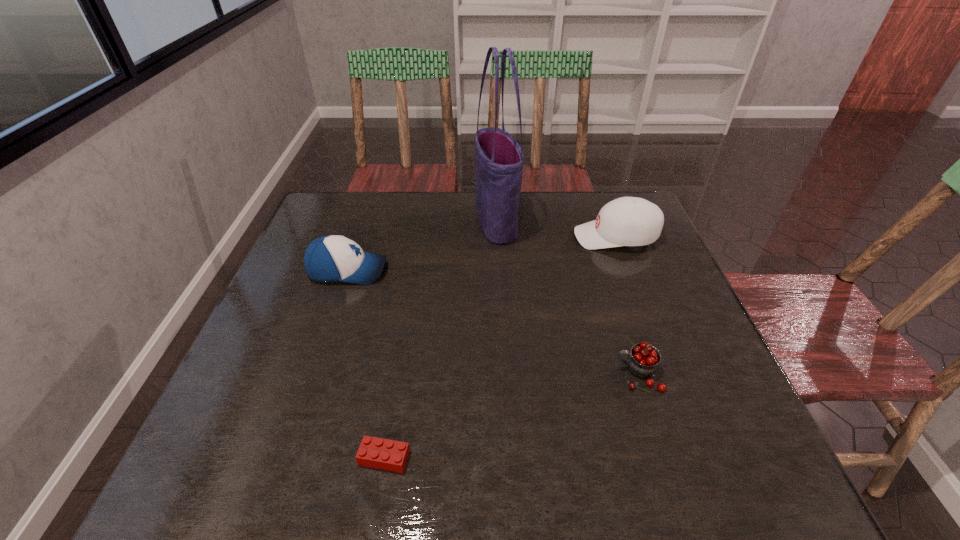
Find the location of `object that is at the left edge`. object that is at the left edge is located at coordinates (332, 258).

Identify the location of baseball cap at the right edge. (627, 221).

Identify the location of cherry positioned at the right edge. (643, 361).

Find the location of a particular element. This screenshot has width=960, height=540. object located at the far right corner is located at coordinates (627, 221).

This screenshot has height=540, width=960. In order to click on vacant space at the far edge of the desktop in this screenshot , I will do pos(576,211).

What are the coordinates of `vacant region at the near edge` in the screenshot? It's located at (508, 465).

This screenshot has width=960, height=540. Identify the location of free space at the right edge. (682, 289).

In order to click on free region at the far right corner in this screenshot , I will do `click(613, 195)`.

This screenshot has height=540, width=960. I want to click on empty space between the farther baseball cap and the shortest object, so click(x=500, y=347).

Locate an element on the screen. This screenshot has width=960, height=540. free spot between the right baseball cap and the fourth farthest object is located at coordinates (627, 306).